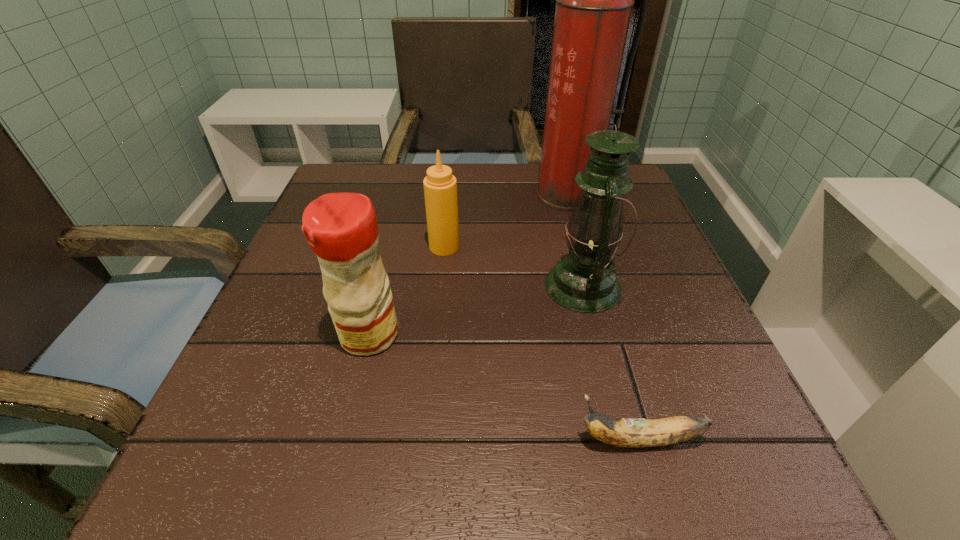
The image size is (960, 540). In the image, there is a desktop. Identify the location of free space at the near right corner. (718, 482).

Locate an element on the screen. The height and width of the screenshot is (540, 960). unoccupied area between the fourth tallest object and the nearer condiment is located at coordinates (407, 291).

Where is `free spot between the second tallest object and the second object from left to right`? This screenshot has width=960, height=540. free spot between the second tallest object and the second object from left to right is located at coordinates coord(514,266).

Locate an element on the screen. The height and width of the screenshot is (540, 960). vacant area that lies between the shorter condiment and the farthest object is located at coordinates (506, 221).

You are a GUI agent. You are given a task and a screenshot of the screen. Output one action in this format:
    pyautogui.click(x=<x>, y=<y>)
    Task: Click on the vacant area that lies between the second tallest object and the leftmost object
    The image size is (960, 540).
    Given the screenshot: What is the action you would take?
    pyautogui.click(x=476, y=310)

In order to click on free space between the taller condiment and the right condiment in this screenshot , I will do `click(407, 291)`.

Locate an element on the screen. Image resolution: width=960 pixels, height=540 pixels. free space between the third shortest object and the fire extinguisher is located at coordinates (468, 265).

What are the coordinates of `empty space between the second tallest object and the fourth tallest object` in the screenshot? It's located at (514, 266).

I want to click on unoccupied position between the third shortest object and the banana, so click(504, 387).

This screenshot has width=960, height=540. In order to click on blank region between the banana and the second object from left to right in this screenshot , I will do `click(541, 343)`.